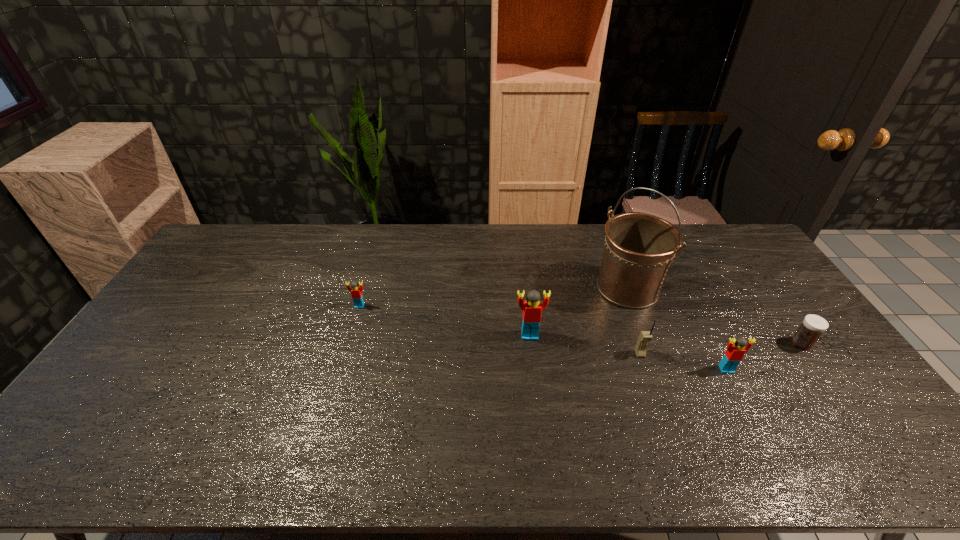
With all Legos evenly spaced, where should an extra Lego be placed on the left to continue the pattern? Please point out a vacant space. Please provide its 2D coordinates. Your answer should be formatted as a tuple, i.e. [(x, y)], where the tuple contains the x and y coordinates of a point satisfying the conditions above.

[(210, 280)]